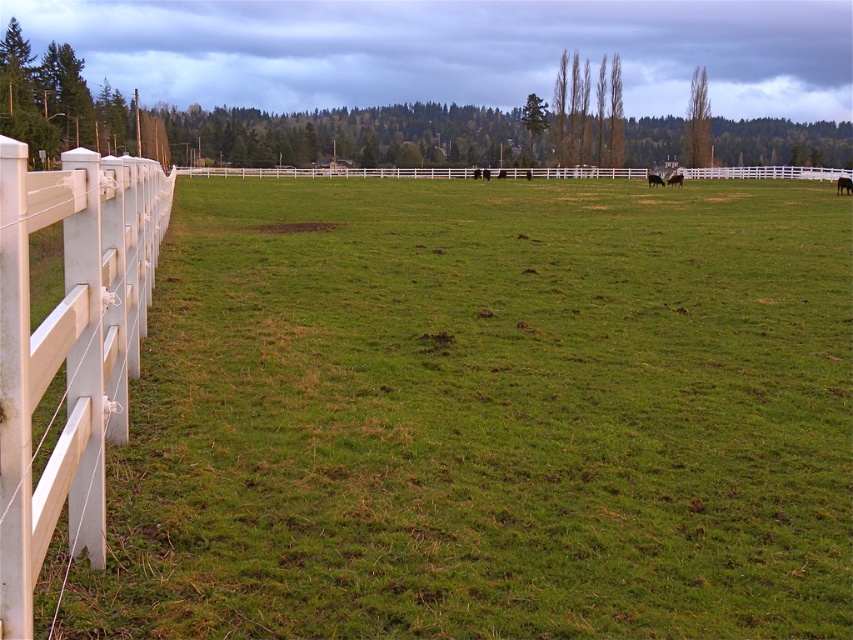
Question: Is white wooden fence at left positioned in front of brown glossy horse at center-right?

Choices:
 (A) yes
 (B) no

Answer: (A)

Question: Can you confirm if white plastic fence at center is positioned above black glossy horse at center?

Choices:
 (A) yes
 (B) no

Answer: (A)

Question: Which point is farther to the camera?

Choices:
 (A) black glossy horse at center
 (B) white plastic fence at center

Answer: (B)

Question: Is white wooden fence at left positioned before black glossy cow at right?

Choices:
 (A) no
 (B) yes

Answer: (B)

Question: Which point is farther from the camera taking this photo?

Choices:
 (A) (13, 564)
 (B) (839, 186)
 (C) (647, 172)
 (D) (679, 182)

Answer: (C)

Question: Which object appears closest to the camera in this image?

Choices:
 (A) white plastic fence at center
 (B) white wooden fence at left
 (C) black glossy cow at right
 (D) brown glossy horse at center-right

Answer: (B)